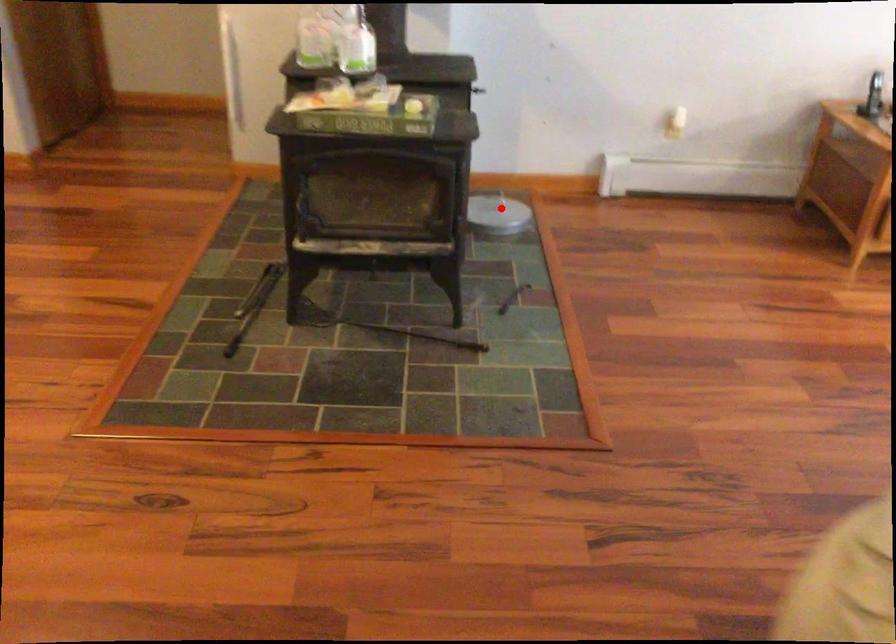
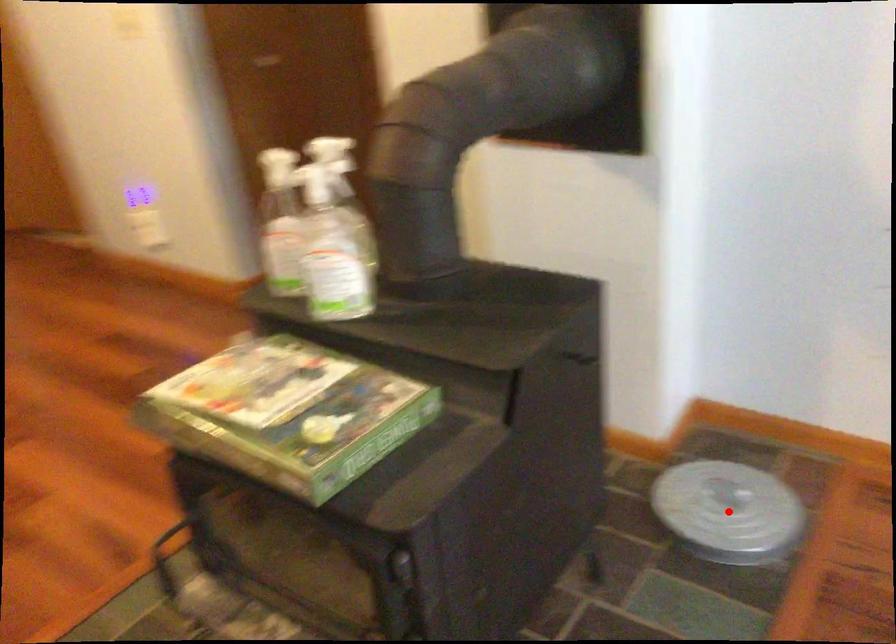
I am providing you with two images of the same scene from different viewpoints. A red point is marked on the first image and another point is marked on the second image. Do the highlighted points in image1 and image2 indicate the same real-world spot?

Yes